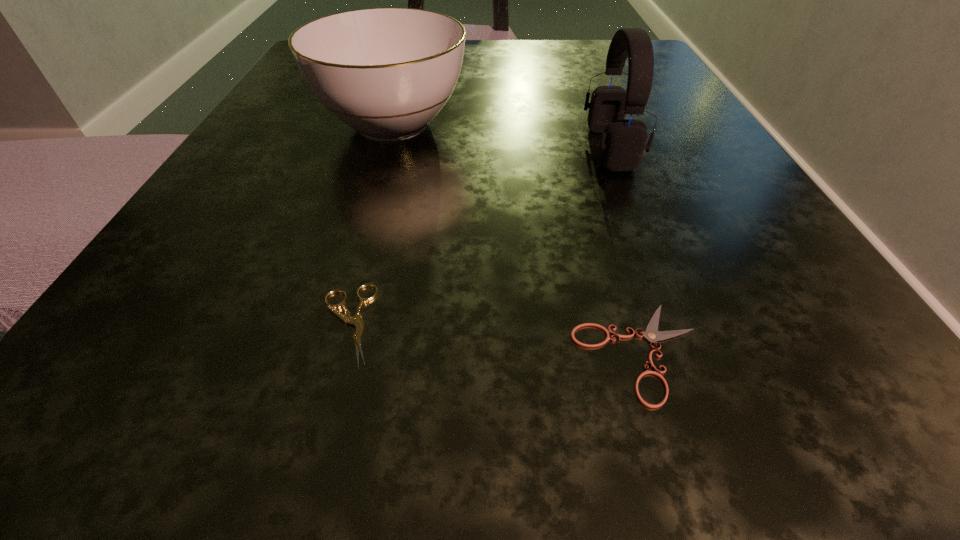
You are a GUI agent. You are given a task and a screenshot of the screen. Output one action in this format:
    pyautogui.click(x=<x>, y=<y>)
    Task: Click on the vacant area situated 0.200m on the back of the second shortest object
    This screenshot has width=960, height=540.
    Given the screenshot: What is the action you would take?
    pyautogui.click(x=387, y=169)

Where is `free space located on the back of the shortest object`? The width and height of the screenshot is (960, 540). free space located on the back of the shortest object is located at coordinates (590, 190).

Locate an element on the screen. Image resolution: width=960 pixels, height=540 pixels. object situated at the far edge is located at coordinates (386, 73).

Where is `object at the left edge`? This screenshot has height=540, width=960. object at the left edge is located at coordinates (386, 73).

What are the coordinates of `headset that is positioned at the right edge` in the screenshot? It's located at (623, 142).

Locate an element on the screen. Image resolution: width=960 pixels, height=540 pixels. shears present at the right edge is located at coordinates (651, 334).

Find the location of a particular element. object at the far left corner is located at coordinates (386, 73).

The width and height of the screenshot is (960, 540). Find the location of `object located at the near right corner`. object located at the near right corner is located at coordinates (651, 334).

I want to click on free space at the far edge, so click(x=499, y=58).

In the image, there is a desktop. In order to click on vacant space at the near edge in this screenshot , I will do `click(375, 380)`.